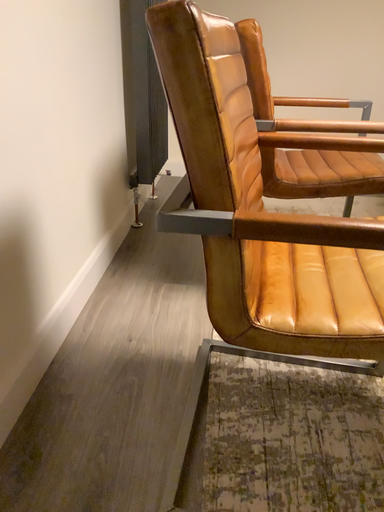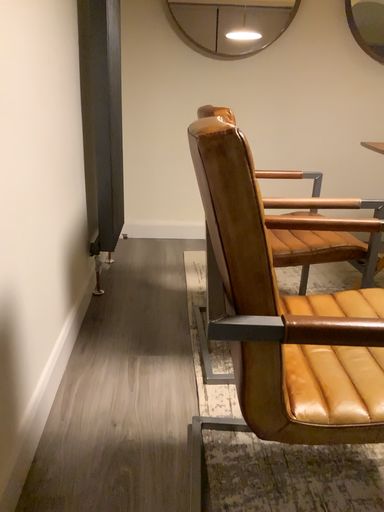
Question: Which way did the camera rotate in the video?

Choices:
 (A) rotated downward
 (B) rotated upward

Answer: (B)